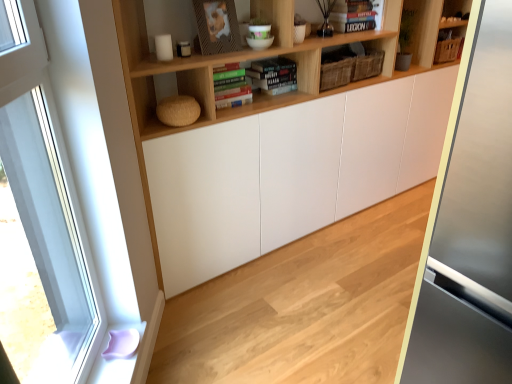
Question: From the image's perspective, is wooden shelf at upper center above or below hardcover book at upper center, placed as the first book when sorted from right to left?

Choices:
 (A) below
 (B) above

Answer: (A)

Question: In the image, is wooden shelf at upper center positioned in front of or behind hardcover book at upper center, placed as the first book when sorted from right to left?

Choices:
 (A) front
 (B) behind

Answer: (A)

Question: Estimate the real-world distances between objects in this image. Which object is closer to the natural wood floor at center?

Choices:
 (A) hardcover book at upper center, which is the 1th book from top to bottom
 (B) wooden shelf at upper center
 (C) clear glass window at left
 (D) hardcover book at center, positioned as the 2th book in top-to-bottom order

Answer: (C)

Question: Which is nearer to the hardcover book at upper center, marked as the 2th book in a front-to-back arrangement?

Choices:
 (A) natural wood floor at center
 (B) clear glass window at left
 (C) wooden shelf at upper center
 (D) hardcover book at center, which appears as the 1th book when viewed from the left

Answer: (C)